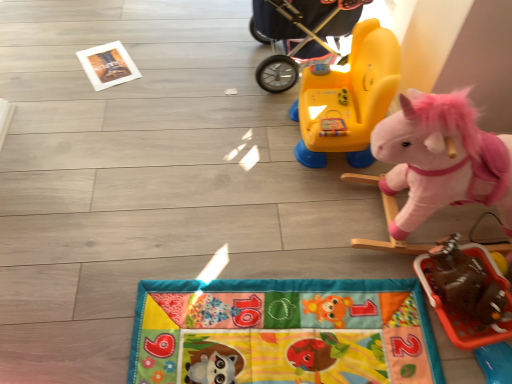
Question: In the image, is yellow plastic baby carriage at upper center positioned in front of or behind pink plush unicorn at right, marked as the 2th toy in a bottom-to-top arrangement?

Choices:
 (A) behind
 (B) front

Answer: (A)

Question: In the image, is yellow plastic baby carriage at upper center on the left side or the right side of pink plush unicorn at right, positioned as the 2th toy in top-to-bottom order?

Choices:
 (A) left
 (B) right

Answer: (A)

Question: Based on their relative distances, which object is nearer to the pink plush unicorn at right, marked as the 2th toy in a bottom-to-top arrangement?

Choices:
 (A) yellow plastic baby carriage at upper center
 (B) yellow plastic rocker at upper center, which appears as the 1th toy when viewed from the top
 (C) brown fuzzy elephant at lower right, positioned as the first toy in bottom-to-top order

Answer: (C)

Question: Considering the real-world distances, which object is farthest from the brown fuzzy elephant at lower right, which is the third toy from top to bottom?

Choices:
 (A) yellow plastic rocker at upper center, the 3th toy when ordered from bottom to top
 (B) pink plush unicorn at right, marked as the 2th toy in a bottom-to-top arrangement
 (C) yellow plastic baby carriage at upper center

Answer: (C)